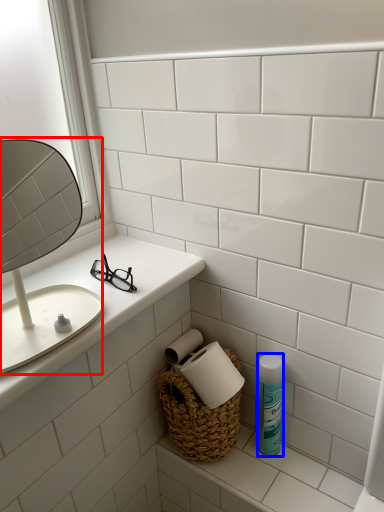
Question: Which point is closer to the camera, mirror (highlighted by a red box) or mouthwash (highlighted by a blue box)?

Choices:
 (A) mirror
 (B) mouthwash

Answer: (A)